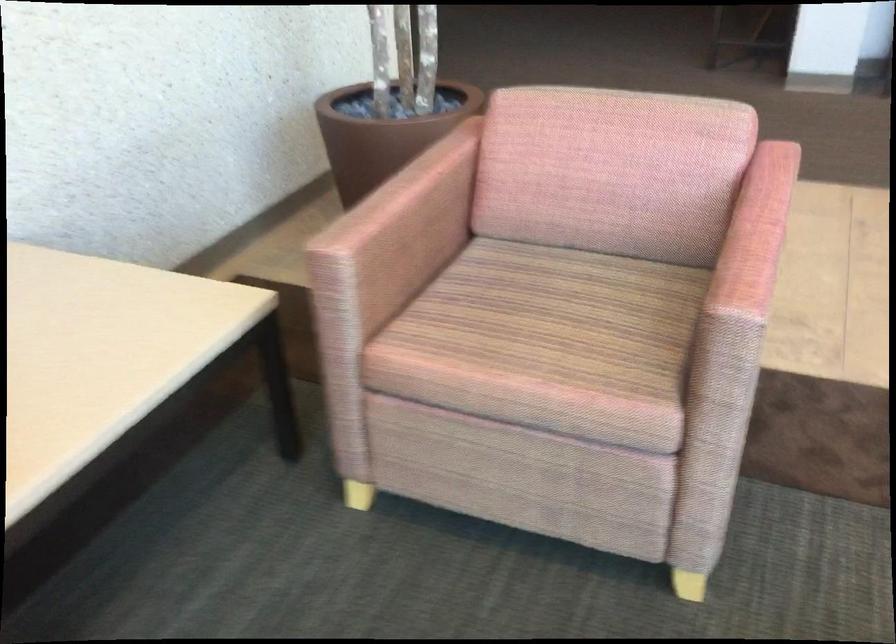
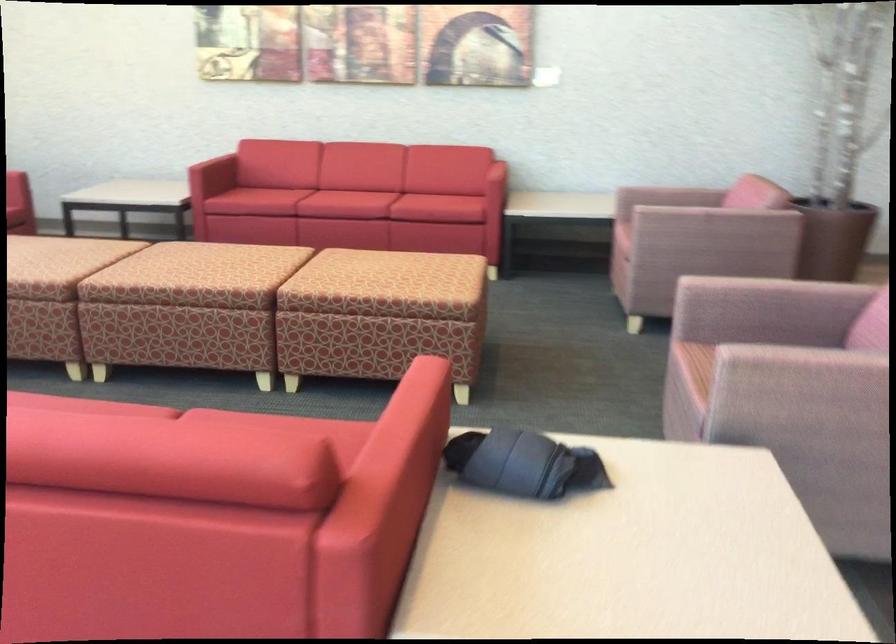
The point at (x=487, y=249) is marked in the first image. Where is the corresponding point in the second image?

(669, 196)